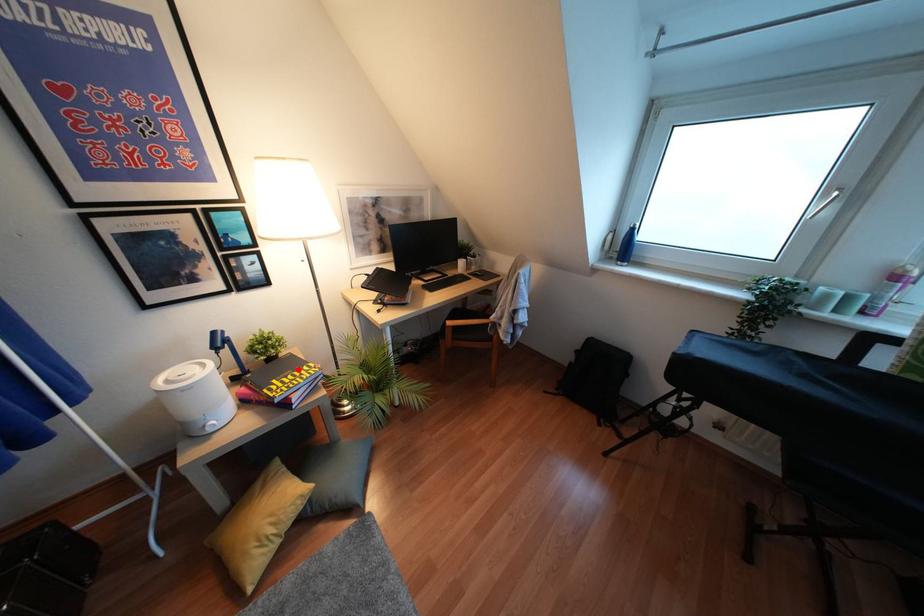
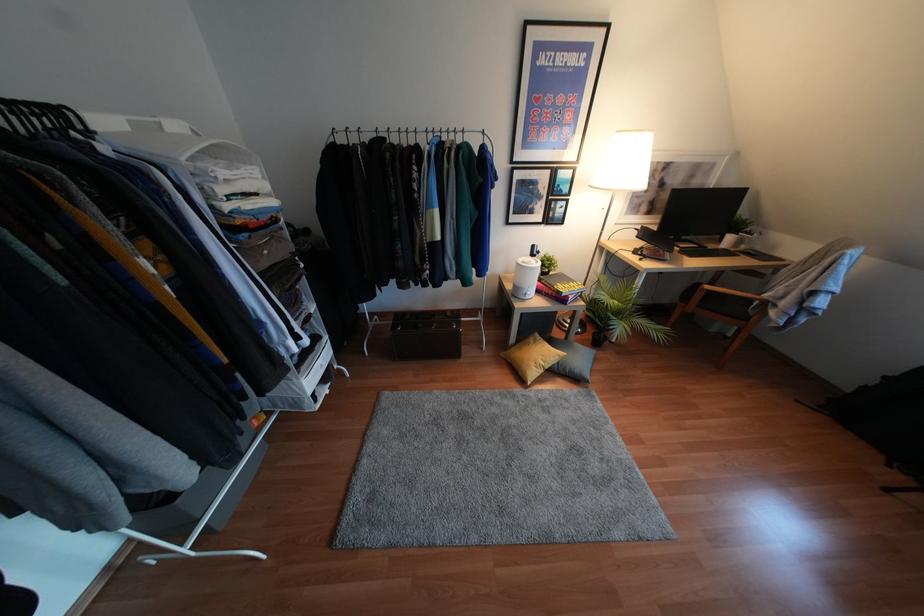
Question: I am providing you with two images of the same scene from different viewpoints. In image1, a red point is highlighted. Considering the same 3D point in image2, which of the following is correct?

Choices:
 (A) It is closer
 (B) It is farther

Answer: (B)